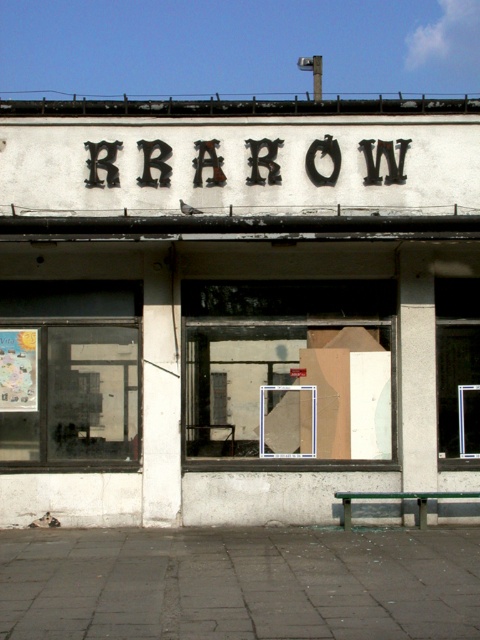
You are standing in front of the building and want to see the sign that says KRAROW. Which object should you look at first, the white concrete storefront at center or the transparent glass window at left?

The white concrete storefront at center is above the transparent glass window at left, so you should look at the white concrete storefront at center first to see the sign that says KRAROW.

You are a delivery person trying to locate the KRAROW building. You see the black metal sign at center and the wooden bulletin board at center. Which object is more to the left?

The wooden bulletin board at center is more to the left because the black metal sign at center is positioned on its right side.

You are a delivery person trying to find the entrance to the building. The entrance is located below the black metal sign at center. Can you see the entrance through the transparent glass window at right?

The transparent glass window at right is positioned under the black metal sign at center, so the entrance is likely behind the transparent glass window at right.